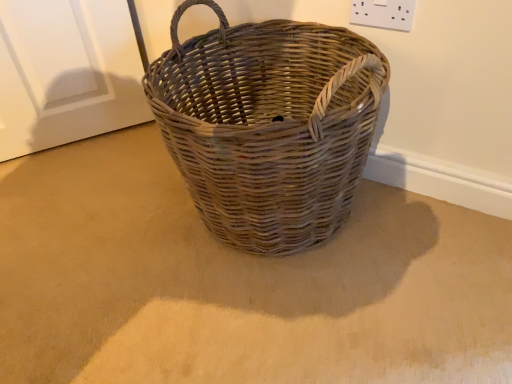
Locate an element on the screen. The image size is (512, 384). free point to the left of natural woven picnic basket at center is located at coordinates (91, 235).